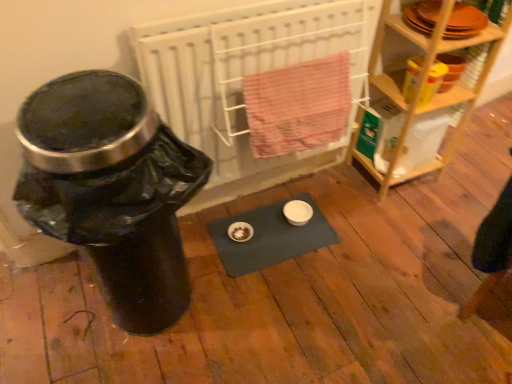
Question: Considering the relative sizes of wooden shelf at right and black plastic water cooler at left in the image provided, is wooden shelf at right bigger than black plastic water cooler at left?

Choices:
 (A) yes
 (B) no

Answer: (B)

Question: Are wooden shelf at right and black plastic water cooler at left beside each other?

Choices:
 (A) yes
 (B) no

Answer: (B)

Question: From the image's perspective, is wooden shelf at right on black plastic water cooler at left?

Choices:
 (A) no
 (B) yes

Answer: (B)

Question: From a real-world perspective, is wooden shelf at right positioned under black plastic water cooler at left based on gravity?

Choices:
 (A) no
 (B) yes

Answer: (A)

Question: From a real-world perspective, is wooden shelf at right positioned over black plastic water cooler at left based on gravity?

Choices:
 (A) no
 (B) yes

Answer: (B)

Question: Is wooden shelf at right shorter than black plastic water cooler at left?

Choices:
 (A) yes
 (B) no

Answer: (B)

Question: Does white radiator at center have a smaller size compared to black plastic water cooler at left?

Choices:
 (A) yes
 (B) no

Answer: (A)

Question: From the image's perspective, would you say white radiator at center is shown under black plastic water cooler at left?

Choices:
 (A) yes
 (B) no

Answer: (B)

Question: Is white radiator at center to the right of black plastic water cooler at left from the viewer's perspective?

Choices:
 (A) no
 (B) yes

Answer: (B)

Question: Does white radiator at center touch black plastic water cooler at left?

Choices:
 (A) yes
 (B) no

Answer: (B)

Question: From a real-world perspective, is white radiator at center positioned under black plastic water cooler at left based on gravity?

Choices:
 (A) yes
 (B) no

Answer: (B)

Question: Is white radiator at center closer to camera compared to black plastic water cooler at left?

Choices:
 (A) yes
 (B) no

Answer: (B)

Question: Is blue fabric yoga mat at center not close to white radiator at center?

Choices:
 (A) yes
 (B) no

Answer: (B)